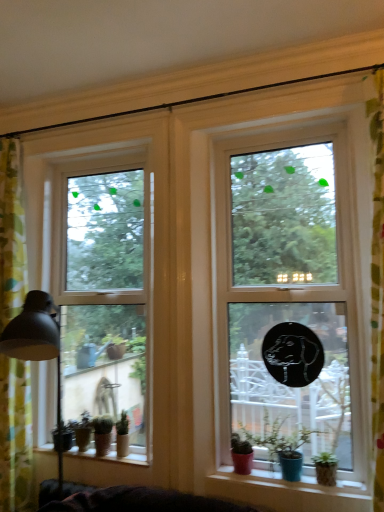
Question: Can matte ceramic pots at lower center, arranged as the 2th window sill when viewed from the back, be found inside green matte plant pot at lower left, which is the fourth houseplant in right-to-left order?

Choices:
 (A) yes
 (B) no

Answer: (B)

Question: Is green matte plant pot at lower left, the fourth houseplant positioned from the front, taller than matte ceramic pots at lower center, the 1th window sill in the right-to-left sequence?

Choices:
 (A) yes
 (B) no

Answer: (A)

Question: Could you tell me if green matte plant pot at lower left, the fourth houseplant positioned from the front, is turned towards matte ceramic pots at lower center, the first window sill from the front?

Choices:
 (A) no
 (B) yes

Answer: (A)

Question: Is green matte plant pot at lower left, which is the fourth houseplant in right-to-left order, positioned beyond the bounds of matte ceramic pots at lower center, the first window sill from the front?

Choices:
 (A) no
 (B) yes

Answer: (B)

Question: From a real-world perspective, is green matte plant pot at lower left, which is the fourth houseplant in right-to-left order, under matte ceramic pots at lower center, arranged as the 2th window sill when viewed from the back?

Choices:
 (A) yes
 (B) no

Answer: (B)

Question: In the image, is green matte plant pot at lower left, which is the fourth houseplant in right-to-left order, positioned in front of or behind matte black lampshade at left?

Choices:
 (A) behind
 (B) front

Answer: (A)

Question: Does point (87, 411) appear closer or farther from the camera than point (29, 312)?

Choices:
 (A) closer
 (B) farther

Answer: (B)

Question: Is green matte plant pot at lower left, which is the fourth houseplant in right-to-left order, wider or thinner than matte black lampshade at left?

Choices:
 (A) wide
 (B) thin

Answer: (B)

Question: Is green matte plant pot at lower left, the fourth houseplant positioned from the front, bigger or smaller than matte black lampshade at left?

Choices:
 (A) big
 (B) small

Answer: (B)

Question: Considering the positions of green floral fabric curtain at left and smooth wooden window sill at lower left, placed as the 2th window sill when sorted from front to back, in the image, is green floral fabric curtain at left wider or thinner than smooth wooden window sill at lower left, placed as the 2th window sill when sorted from front to back,?

Choices:
 (A) thin
 (B) wide

Answer: (B)

Question: Considering the positions of green floral fabric curtain at left and smooth wooden window sill at lower left, the first window sill positioned from the left, in the image, is green floral fabric curtain at left taller or shorter than smooth wooden window sill at lower left, the first window sill positioned from the left,?

Choices:
 (A) short
 (B) tall

Answer: (B)

Question: From the image's perspective, is green floral fabric curtain at left located above or below smooth wooden window sill at lower left, positioned as the first window sill in back-to-front order?

Choices:
 (A) above
 (B) below

Answer: (A)

Question: Is point (4, 219) positioned closer to the camera than point (120, 458)?

Choices:
 (A) farther
 (B) closer

Answer: (A)

Question: Looking at the image, does clear glass window at left, which is the first window in back-to-front order, seem bigger or smaller compared to matte pink pot at lower center, which is the 1th houseplant from right to left?

Choices:
 (A) small
 (B) big

Answer: (B)

Question: In terms of height, does clear glass window at left, positioned as the 1th window in left-to-right order, look taller or shorter compared to matte pink pot at lower center, which is the 1th houseplant from right to left?

Choices:
 (A) short
 (B) tall

Answer: (B)